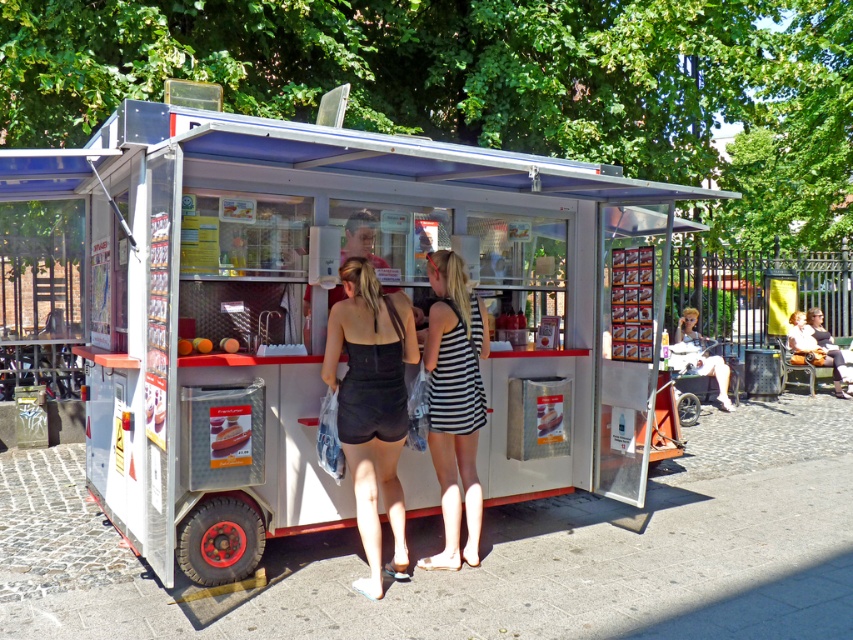
You are a customer at the food cart and want to see both the black matte dress at center and the striped fabric dress at center displayed inside the cart. Which dress is positioned closer to the front of the cart?

The black matte dress at center is closer to the viewer than the striped fabric dress at center, so it is positioned closer to the front of the cart.

You are standing at the food cart and want to reach the point labeled as point (801, 314). However, there is an obstacle at point (175, 372). Can you walk directly to your destination without going around the obstacle?

Point (175, 372) is in front of point (801, 314), so you cannot walk directly to point (801, 314) without going around the obstacle at point (175, 372).